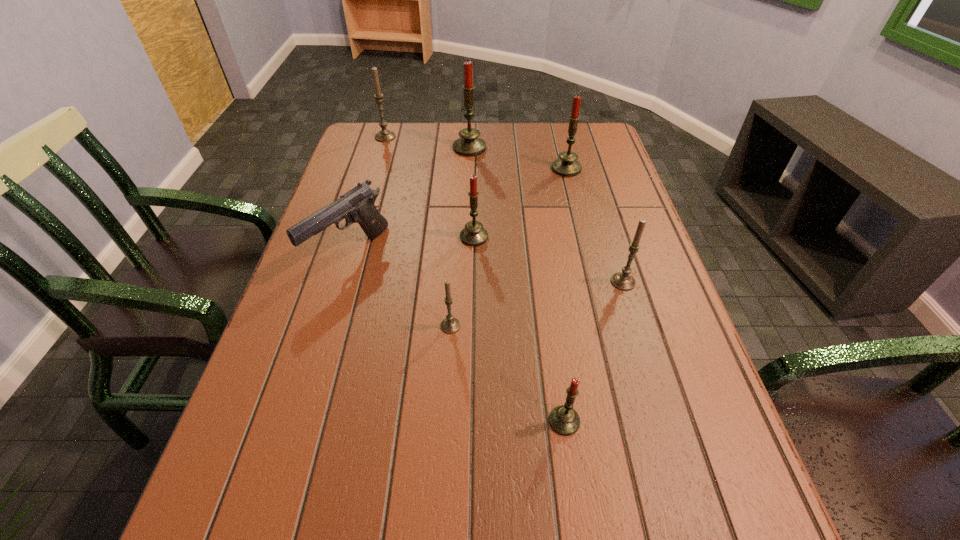
You are a GUI agent. You are given a task and a screenshot of the screen. Output one action in this format:
    pyautogui.click(x=<x>, y=<y>)
    Task: Click on the free space between the third farthest red candle and the gun
    The height and width of the screenshot is (540, 960).
    Given the screenshot: What is the action you would take?
    pyautogui.click(x=412, y=245)

At what (x,y) coordinates should I click in order to perform the action: click on free spot between the sixth nearest object and the tallest candle. Please return your answer as a coordinate pair (x, y). Looking at the image, I should click on (518, 158).

The height and width of the screenshot is (540, 960). What are the coordinates of `vacant area that lies between the biggest gray candle and the second farthest gray candle` in the screenshot? It's located at (504, 210).

The width and height of the screenshot is (960, 540). Identify the location of vacant space in between the black gun and the second nearest object. [400, 289].

You are a GUI agent. You are given a task and a screenshot of the screen. Output one action in this format:
    pyautogui.click(x=<x>, y=<y>)
    Task: Click on the vacant space that's between the second nearest candle and the second red candle from right to left
    This screenshot has height=540, width=960.
    Given the screenshot: What is the action you would take?
    pyautogui.click(x=508, y=373)

The image size is (960, 540). Find the location of `empty space between the nearest object and the seventh farthest object`. empty space between the nearest object and the seventh farthest object is located at coordinates (508, 373).

Find the location of a particular element. the third closest object to the smallest red candle is located at coordinates (473, 234).

Identify the location of the fourth closest object to the tallest candle. Image resolution: width=960 pixels, height=540 pixels. (357, 205).

Identify which candle is the second closest to the biggest gray candle. Please provide its 2D coordinates. Your answer should be formatted as a tuple, i.e. [(x, y)], where the tuple contains the x and y coordinates of a point satisfying the conditions above.

[(473, 234)]

This screenshot has height=540, width=960. Find the location of `candle that is the third closest to the fourth farthest candle`. candle that is the third closest to the fourth farthest candle is located at coordinates (567, 166).